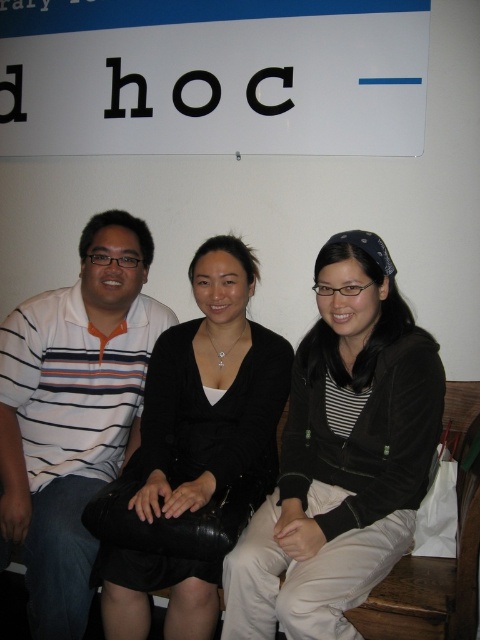
Who is taller, white paper sign at upper center or black matte dress at center?

black matte dress at center is taller.

Is white paper sign at upper center behind black matte dress at center?

Yes, it is behind black matte dress at center.

Between point (132, 68) and point (203, 580), which one is positioned in front?

Positioned in front is point (203, 580).

Where is `white paper sign at upper center`? The image size is (480, 640). white paper sign at upper center is located at coordinates (213, 76).

This screenshot has width=480, height=640. Find the location of `black velvet jacket at center`. black velvet jacket at center is located at coordinates (342, 456).

Does black velvet jacket at center have a greater width compared to black matte dress at center?

Correct, the width of black velvet jacket at center exceeds that of black matte dress at center.

Which is in front, point (316, 419) or point (186, 456)?

Point (316, 419)

Where is `black velvet jacket at center`? The image size is (480, 640). black velvet jacket at center is located at coordinates (342, 456).

Who is shorter, black velvet jacket at center or white striped shirt at left?

black velvet jacket at center

The height and width of the screenshot is (640, 480). What are the coordinates of `black velvet jacket at center` in the screenshot? It's located at (342, 456).

I want to click on black velvet jacket at center, so click(342, 456).